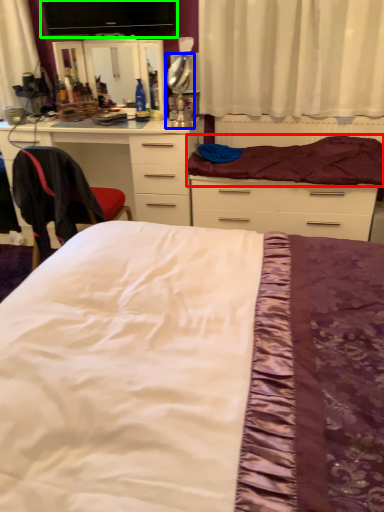
Question: Which object is the closest to the mattress (highlighted by a red box)? Choose among these: table lamp (highlighted by a blue box) or computer monitor (highlighted by a green box).

Choices:
 (A) table lamp
 (B) computer monitor

Answer: (A)